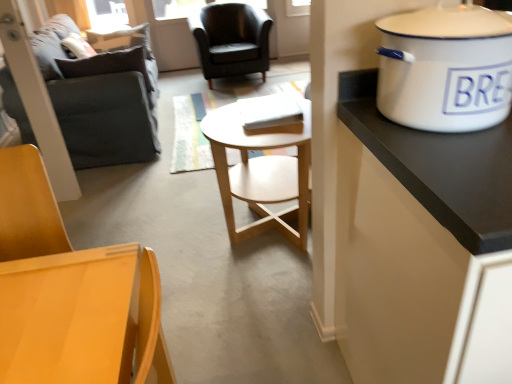
Question: Can you confirm if dark gray fabric couch at left is thinner than white enamel cooker at upper right?

Choices:
 (A) yes
 (B) no

Answer: (B)

Question: Is dark gray fabric couch at left next to white enamel cooker at upper right and touching it?

Choices:
 (A) no
 (B) yes

Answer: (A)

Question: Is dark gray fabric couch at left positioned beyond the bounds of white enamel cooker at upper right?

Choices:
 (A) yes
 (B) no

Answer: (A)

Question: Is the depth of dark gray fabric couch at left less than that of white enamel cooker at upper right?

Choices:
 (A) no
 (B) yes

Answer: (A)

Question: Could white enamel cooker at upper right be considered to be inside dark gray fabric couch at left?

Choices:
 (A) yes
 (B) no

Answer: (B)

Question: Is dark gray fabric couch at left facing away from white enamel cooker at upper right?

Choices:
 (A) no
 (B) yes

Answer: (A)

Question: Can you confirm if matte wood chair at lower left, the second chair viewed from the back, is thinner than matte black armchair at center, the 1th chair viewed from the back?

Choices:
 (A) yes
 (B) no

Answer: (A)

Question: Can you confirm if matte wood chair at lower left, placed as the second chair when sorted from top to bottom, is shorter than matte black armchair at center, the 2th chair in the front-to-back sequence?

Choices:
 (A) no
 (B) yes

Answer: (B)

Question: Does matte wood chair at lower left, placed as the second chair when sorted from top to bottom, appear on the right side of matte black armchair at center, which appears as the 2th chair when ordered from the bottom?

Choices:
 (A) yes
 (B) no

Answer: (B)

Question: Could you tell me if matte wood chair at lower left, placed as the second chair when sorted from top to bottom, is facing matte black armchair at center, which appears as the 2th chair when ordered from the bottom?

Choices:
 (A) no
 (B) yes

Answer: (A)

Question: From a real-world perspective, is matte wood chair at lower left, the second chair viewed from the back, below matte black armchair at center, which appears as the first chair when viewed from the top?

Choices:
 (A) no
 (B) yes

Answer: (A)

Question: Is matte wood chair at lower left, placed as the second chair when sorted from top to bottom, turned away from matte black armchair at center, which appears as the 2th chair when ordered from the bottom?

Choices:
 (A) no
 (B) yes

Answer: (B)

Question: Considering the relative sizes of white enamel cooker at upper right and matte wood chair at lower left, the second chair viewed from the back, in the image provided, is white enamel cooker at upper right thinner than matte wood chair at lower left, the second chair viewed from the back,?

Choices:
 (A) no
 (B) yes

Answer: (B)